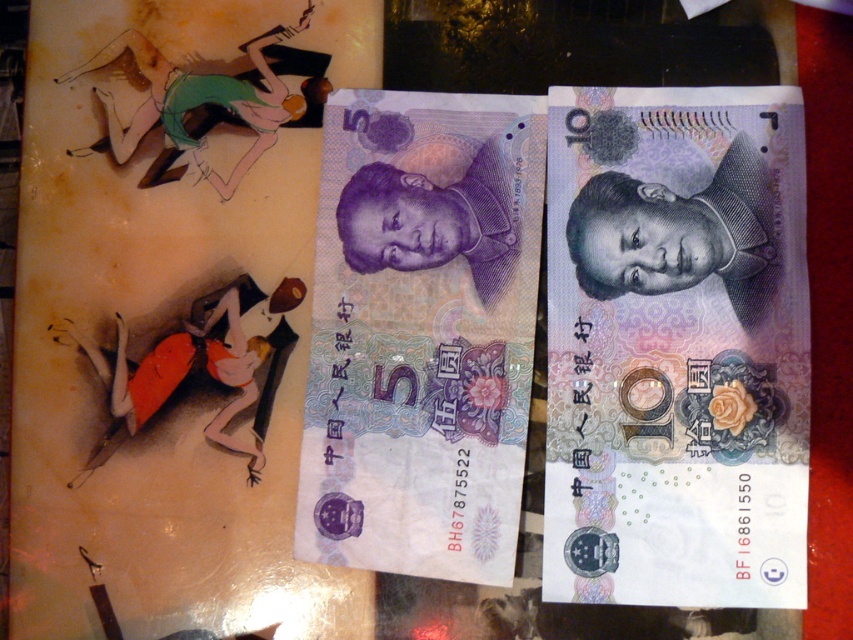
Does matte purple banknote at center appear under purple paper money at center?

Yes, matte purple banknote at center is below purple paper money at center.

Who is more distant from viewer, (567,260) or (477,362)?

The point (477,362) is more distant.

Where is `matte purple banknote at center`? matte purple banknote at center is located at coordinates (676, 348).